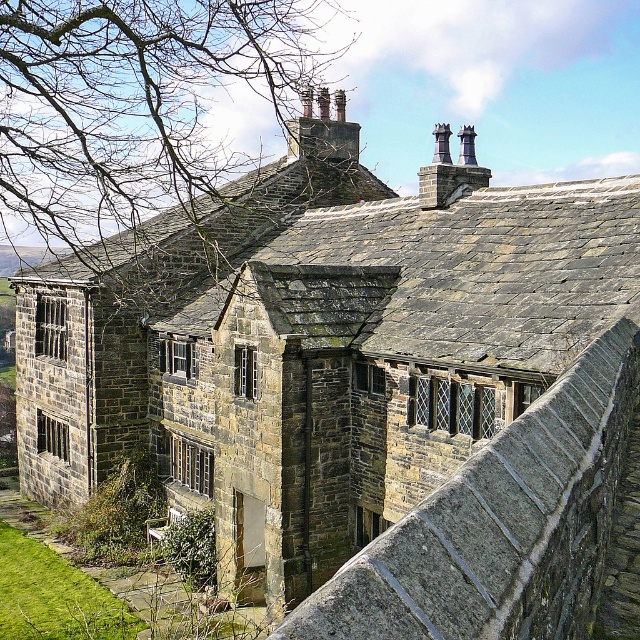
In the scene shown: You are standing in front of the historic stone building and want to place a 2.5 meter tall statue on the stone ledge at upper center. Can the statue fit on the ledge?

The stone ledge at upper center and viewer are 6.15 meters apart, but this distance does not indicate the ledge size. The question cannot be answered with the given information.

Consider the image. You are standing in front of the historic stone building and want to determine the relative positions of two points marked on the structure. Which of the two points, point (164, 3) or point (534, 456), is closer to your current position?

Point (164, 3) is closer to your current position because it is further to the viewer than point (534, 456).

You are standing in front of the historic stone building and notice two features at the upper center of the building. One is the bare branches at upper center and the other is the stone ledge at upper center. Which one is positioned higher?

The bare branches at upper center is located above the stone ledge at upper center, so it is positioned higher.